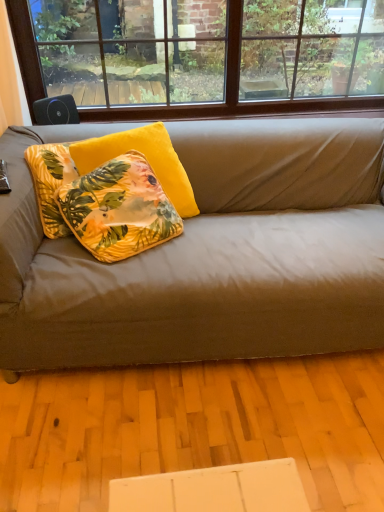
Question: Is point (104, 198) positioned closer to the camera than point (350, 72)?

Choices:
 (A) closer
 (B) farther

Answer: (A)

Question: Considering their positions, is floral yellow pillow at center, which ranks as the 2th pillow in back-to-front order, located in front of or behind brown wood window at upper center?

Choices:
 (A) behind
 (B) front

Answer: (B)

Question: Which object is the farthest from the floral yellow pillow at center, which ranks as the 1th pillow in front-to-back order?

Choices:
 (A) matte gray couch at center
 (B) yellow velvet pillow at center, which is counted as the 1th pillow, starting from the back
 (C) brown wood window at upper center

Answer: (C)

Question: Estimate the real-world distances between objects in this image. Which object is farther from the floral yellow pillow at center, which ranks as the 2th pillow in back-to-front order?

Choices:
 (A) matte gray couch at center
 (B) brown wood window at upper center
 (C) yellow velvet pillow at center, placed as the 2th pillow when sorted from front to back

Answer: (B)